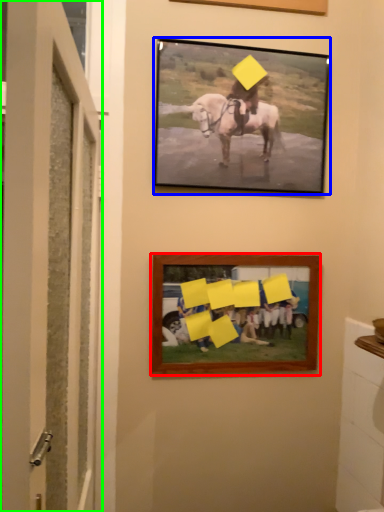
Question: Which is nearer to the picture frame (highlighted by a red box)? picture frame (highlighted by a blue box) or door (highlighted by a green box).

Choices:
 (A) picture frame
 (B) door

Answer: (A)